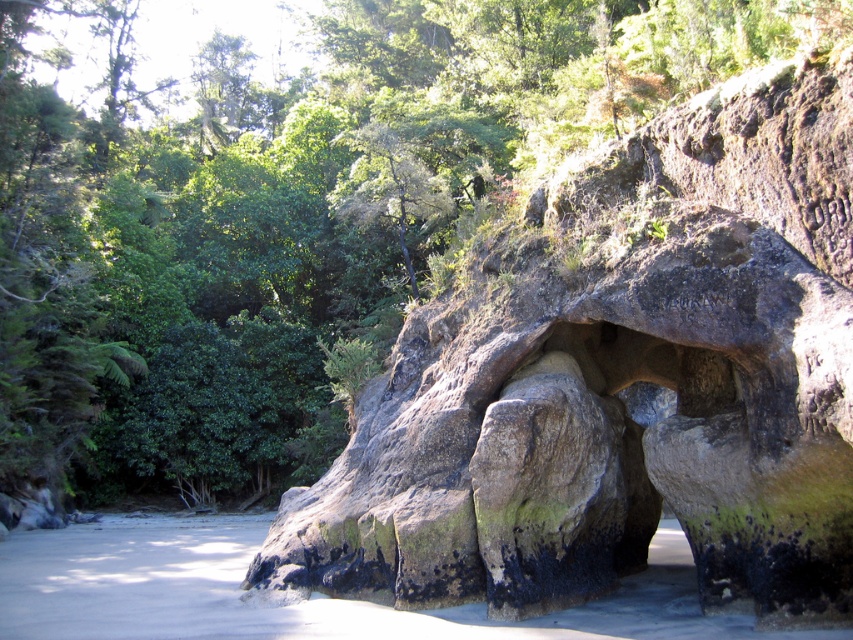
Question: Can you confirm if rough textured rock at center is bigger than green leafy tree at center?

Choices:
 (A) no
 (B) yes

Answer: (A)

Question: Among these points, which one is nearest to the camera?

Choices:
 (A) (479, 374)
 (B) (450, 195)

Answer: (A)

Question: Which point is closer to the camera taking this photo?

Choices:
 (A) (364, 195)
 (B) (428, 513)

Answer: (B)

Question: Can you confirm if rough textured rock at center is thinner than green leafy tree at center?

Choices:
 (A) no
 (B) yes

Answer: (B)

Question: Is rough textured rock at center wider than green leafy tree at center?

Choices:
 (A) yes
 (B) no

Answer: (B)

Question: Which object is farther from the camera taking this photo?

Choices:
 (A) green leafy tree at center
 (B) rough textured rock at center

Answer: (A)